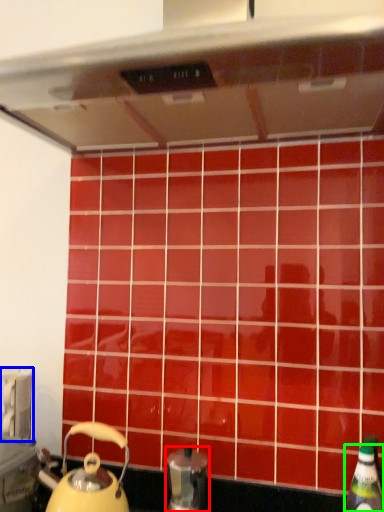
Question: Which object is the farthest from kitchen appliance (highlighted by a red box)? Choose among these: appliance (highlighted by a blue box) or bottle (highlighted by a green box).

Choices:
 (A) appliance
 (B) bottle

Answer: (A)